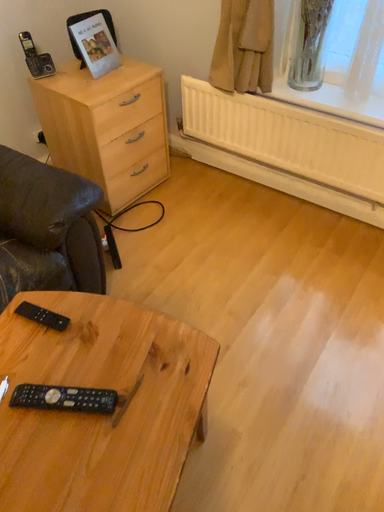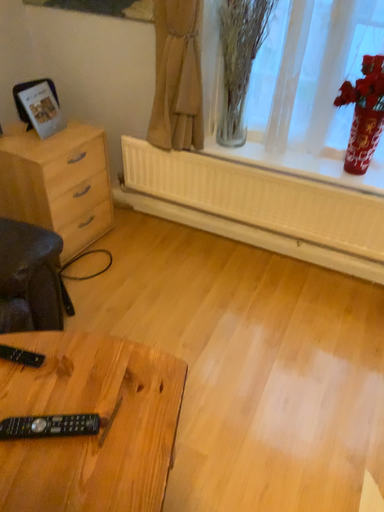
Question: How did the camera likely rotate when shooting the video?

Choices:
 (A) rotated right
 (B) rotated left

Answer: (A)